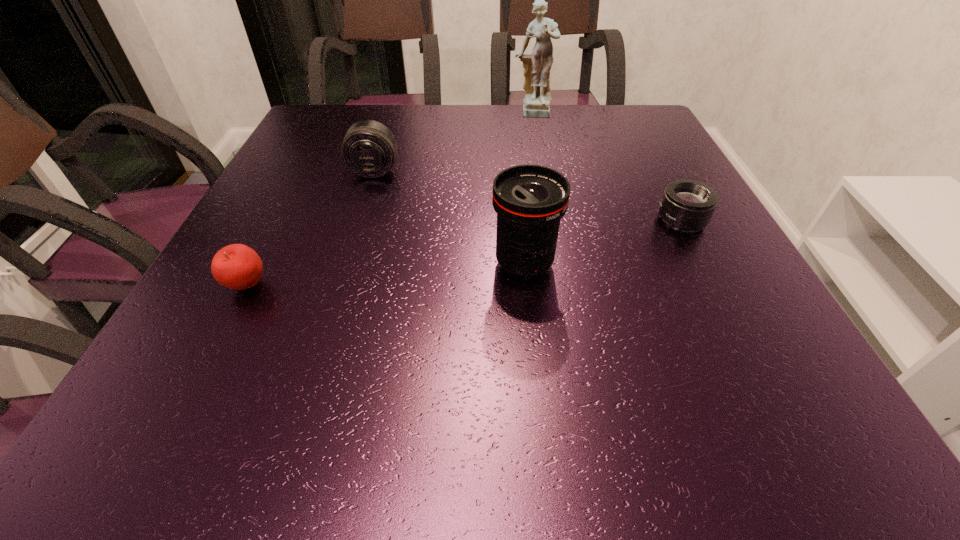
Locate an element on the screen. Image resolution: width=960 pixels, height=540 pixels. vacant region between the second telephoto lens from left to right and the third nearest object is located at coordinates (603, 242).

Identify the location of free area in between the fourth object from right to left and the nearest telephoto lens. The image size is (960, 540). [449, 217].

Find the location of a particular element. free space between the rightmost object and the fourth shortest object is located at coordinates (603, 242).

This screenshot has height=540, width=960. What are the coordinates of `free space between the second shortest object and the second farthest telephoto lens` in the screenshot? It's located at (465, 253).

Locate which object is the fourth closest to the second telephoto lens from left to right. Please provide its 2D coordinates. Your answer should be formatted as a tuple, i.e. [(x, y)], where the tuple contains the x and y coordinates of a point satisfying the conditions above.

[(537, 65)]

Identify which object is the second nearest to the second tallest object. Please provide its 2D coordinates. Your answer should be formatted as a tuple, i.e. [(x, y)], where the tuple contains the x and y coordinates of a point satisfying the conditions above.

[(369, 148)]

Identify which telephoto lens is located as the third nearest to the farthest object. Please provide its 2D coordinates. Your answer should be formatted as a tuple, i.e. [(x, y)], where the tuple contains the x and y coordinates of a point satisfying the conditions above.

[(530, 200)]

Where is `telephoto lens that is the nearest to the farthest object`? telephoto lens that is the nearest to the farthest object is located at coordinates (369, 148).

You are a GUI agent. You are given a task and a screenshot of the screen. Output one action in this format:
    pyautogui.click(x=<x>, y=<y>)
    Task: Click on the free space that satisfies the following two spatial constraints: 1. on the back side of the second shortest object; 2. on the right side of the tallest telephoto lens
    Image resolution: width=960 pixels, height=540 pixels.
    Given the screenshot: What is the action you would take?
    pyautogui.click(x=258, y=265)

This screenshot has width=960, height=540. Identify the location of blank space that satisfies the following two spatial constraints: 1. on the side of the rightmost object with brand markings and control switches; 2. on the front side of the leftmost object. (715, 286).